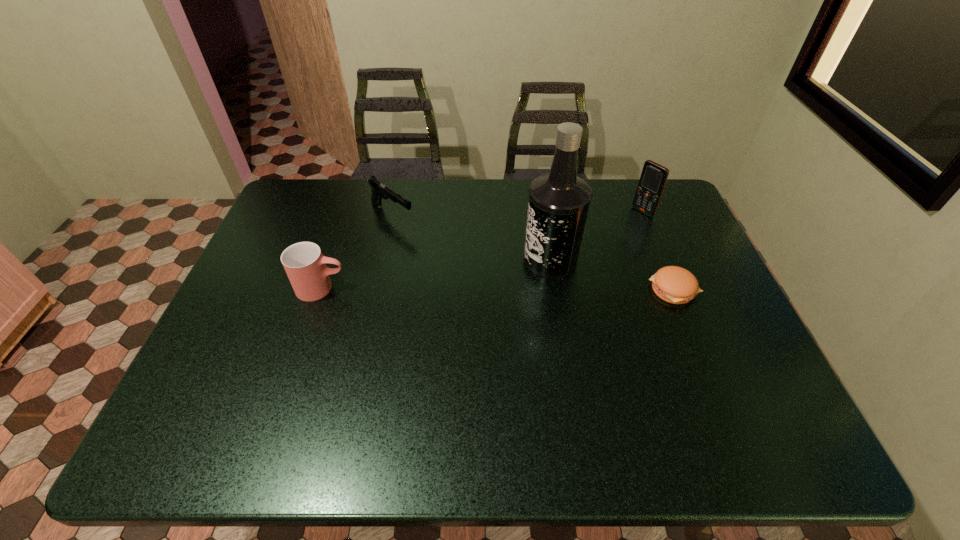
You are a GUI agent. You are given a task and a screenshot of the screen. Output one action in this format:
    pyautogui.click(x=<x>, y=<y>)
    Task: Click on the cup
    
    Given the screenshot: What is the action you would take?
    pyautogui.click(x=305, y=265)

At what (x,y) coordinates should I click in order to perform the action: click on the shortest object. Please return your answer as a coordinate pair (x, y). The image size is (960, 540). Looking at the image, I should click on (673, 284).

You are a GUI agent. You are given a task and a screenshot of the screen. Output one action in this format:
    pyautogui.click(x=<x>, y=<y>)
    Task: Click on the fourth shortest object
    Image resolution: width=960 pixels, height=540 pixels.
    Given the screenshot: What is the action you would take?
    pyautogui.click(x=653, y=178)

In order to click on gun in this screenshot , I will do `click(379, 190)`.

At what (x,y) coordinates should I click in order to perform the action: click on the tallest object. Please return your answer as a coordinate pair (x, y). The width and height of the screenshot is (960, 540). Looking at the image, I should click on (559, 201).

Where is `the third object from right to left`? the third object from right to left is located at coordinates (559, 201).

You are a GUI agent. You are given a task and a screenshot of the screen. Output one action in this format:
    pyautogui.click(x=<x>, y=<y>)
    Task: Click on the vacant space located on the side of the cup with the handle
    The height and width of the screenshot is (540, 960).
    Given the screenshot: What is the action you would take?
    pyautogui.click(x=445, y=288)

You are a GUI agent. You are given a task and a screenshot of the screen. Output one action in this format:
    pyautogui.click(x=<x>, y=<y>)
    Task: Click on the vacant space located on the front of the shortest object
    
    Given the screenshot: What is the action you would take?
    pyautogui.click(x=716, y=392)

Locate an element on the screen. Image resolution: width=960 pixels, height=540 pixels. vacant space located on the screen of the second tallest object is located at coordinates (605, 238).

Locate an element on the screen. vacant space situated on the screen of the second tallest object is located at coordinates (579, 255).